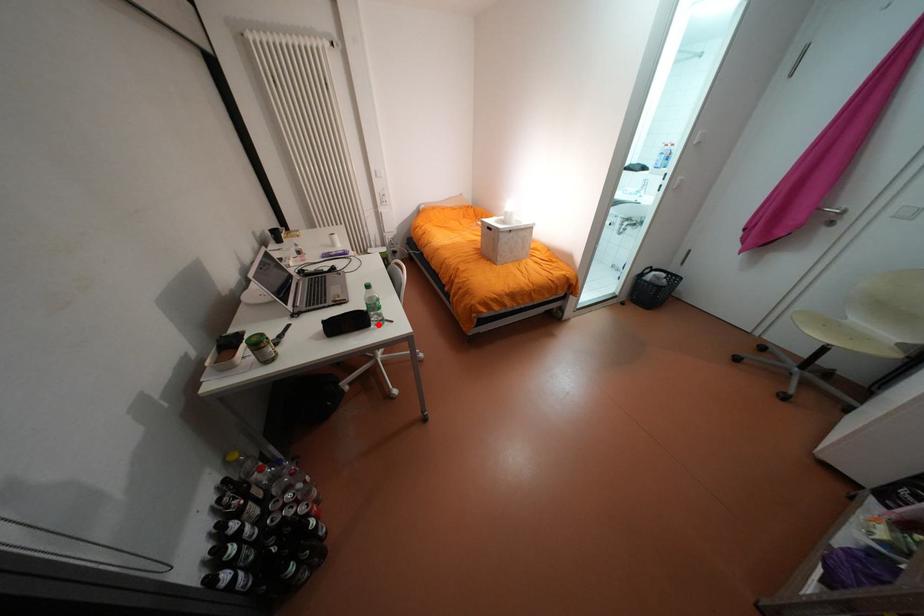
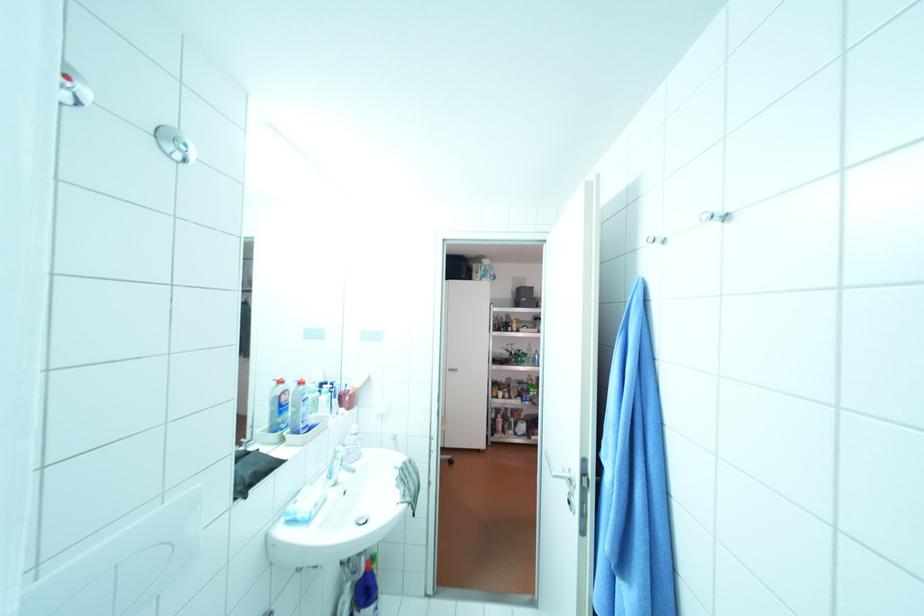
Question: I am providing you with two images of the same scene from different viewpoints. A red point is marked on the first image. Is the red point's position out of view in image 2?

Choices:
 (A) Yes
 (B) No

Answer: (A)